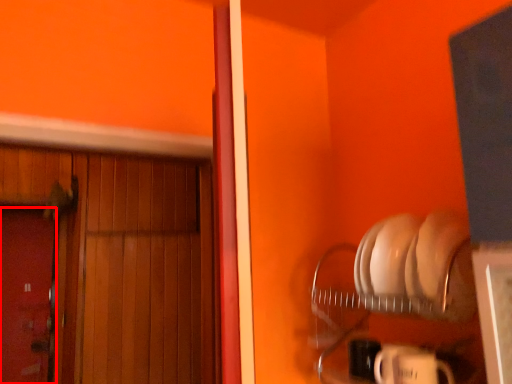
Question: Observing the image, what is the correct spatial positioning of door (annotated by the red box) in reference to door?

Choices:
 (A) right
 (B) left

Answer: (B)